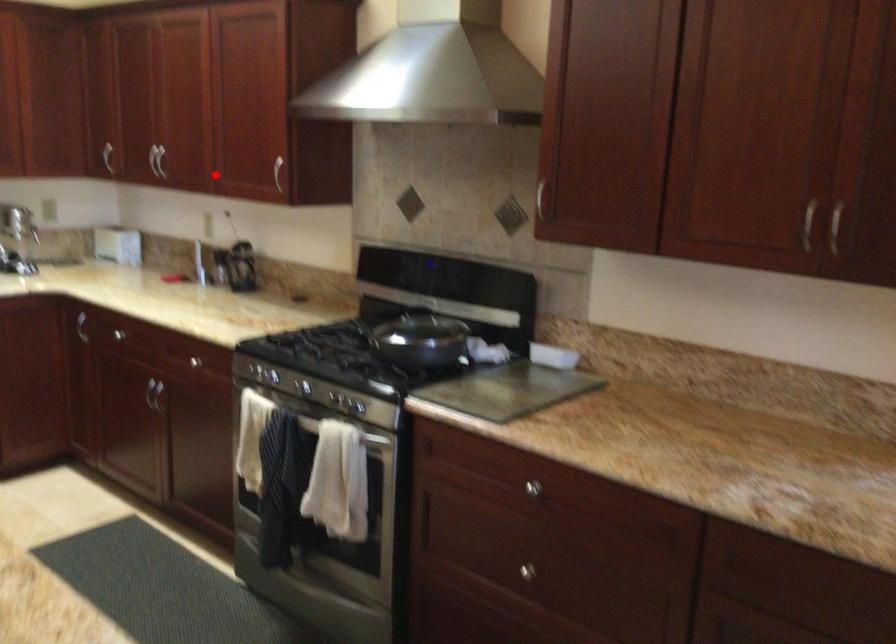
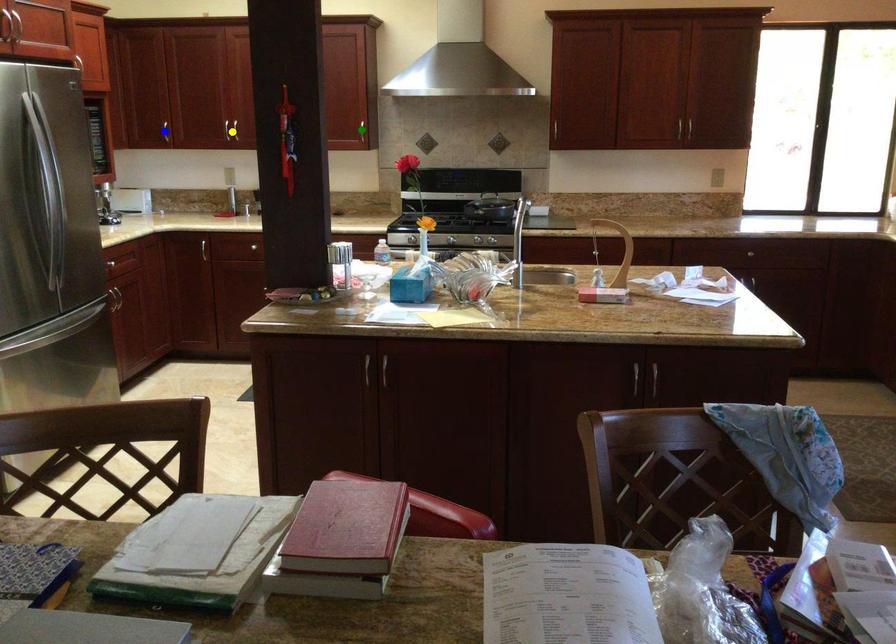
Question: I am providing you with two images of the same scene from different viewpoints. A red point is marked on the first image. You are given multiple points on the second image. Which point in image 2 represents the same 3d spot as the red point in image 1?

Choices:
 (A) green point
 (B) yellow point
 (C) blue point

Answer: (B)